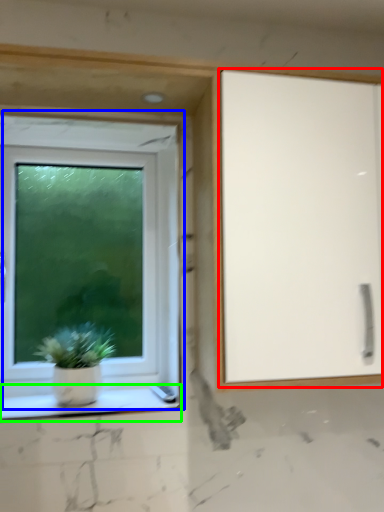
Question: Which object is positioned farthest from screen door (highlighted by a red box)? Select from window (highlighted by a blue box) and window sill (highlighted by a green box).

Choices:
 (A) window
 (B) window sill

Answer: (B)